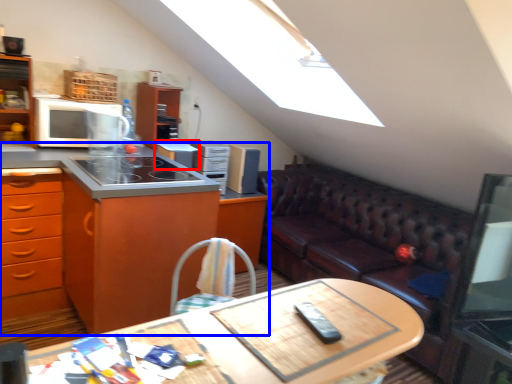
Question: Among these objects, which one is farthest to the camera, appliance (highlighted by a red box) or cabinetry (highlighted by a blue box)?

Choices:
 (A) appliance
 (B) cabinetry

Answer: (A)